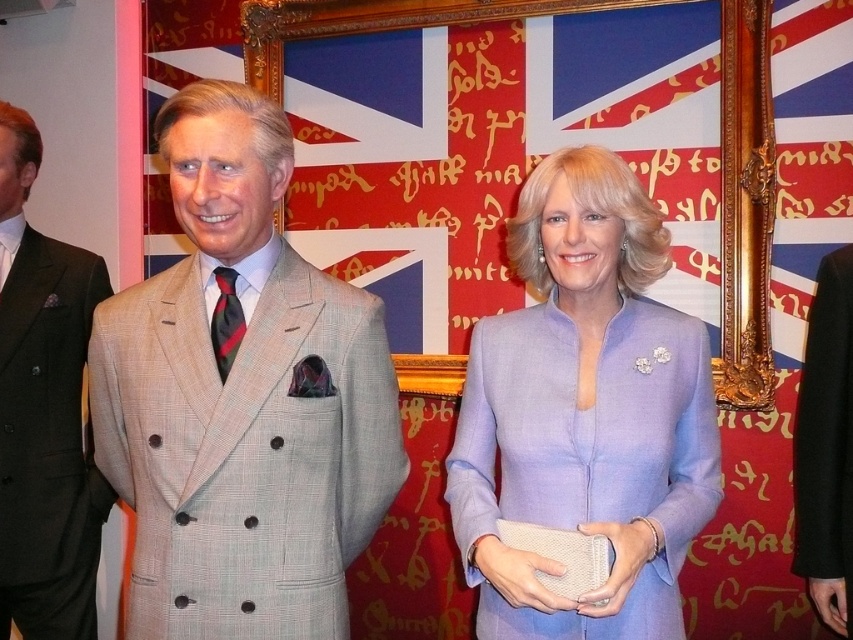
Question: Does lavender woolen suit at center appear on the right side of light beige wool suit at left?

Choices:
 (A) no
 (B) yes

Answer: (B)

Question: Which point is farther to the camera?

Choices:
 (A) light beige wool suit at left
 (B) gold ornate picture frame at center
 (C) black wool suit at right
 (D) lavender woolen suit at center

Answer: (B)

Question: From the image, what is the correct spatial relationship of lavender woolen suit at center in relation to gold ornate picture frame at center?

Choices:
 (A) right
 (B) left

Answer: (B)

Question: Does lavender woolen suit at center come behind light beige wool suit at left?

Choices:
 (A) yes
 (B) no

Answer: (B)

Question: Which object is the farthest from the light beige wool suit at left?

Choices:
 (A) black wool suit at right
 (B) gold ornate picture frame at center
 (C) lavender woolen suit at center
 (D) light beige wool suit at center

Answer: (A)

Question: Among these points, which one is nearest to the camera?

Choices:
 (A) (624, 604)
 (B) (173, 420)
 (C) (811, 566)
 (D) (599, 8)

Answer: (B)